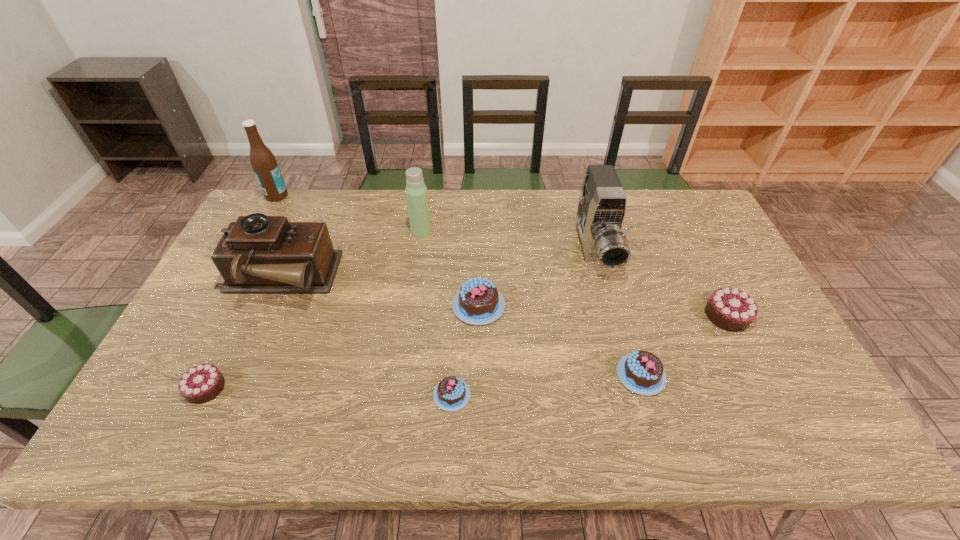
The width and height of the screenshot is (960, 540). I want to click on free region located 0.150m on the left of the rightmost chocolate cake, so click(652, 315).

Locate an element on the screen. blank space located on the right of the rightmost pink chocolate cake is located at coordinates (693, 375).

Where is `free location located on the right of the nearer chocolate chocolate cake`? Image resolution: width=960 pixels, height=540 pixels. free location located on the right of the nearer chocolate chocolate cake is located at coordinates (250, 388).

The image size is (960, 540). What are the coordinates of `free space located 0.180m on the back of the shortest chocolate cake` in the screenshot? It's located at (456, 321).

At what (x,y) coordinates should I click in order to perform the action: click on beer bottle present at the far edge. Please return your answer as a coordinate pair (x, y). Image resolution: width=960 pixels, height=540 pixels. Looking at the image, I should click on (264, 164).

In order to click on camcorder at the far edge in this screenshot , I will do 601,211.

Locate an element on the screen. This screenshot has height=540, width=960. thermos bottle that is positioned at the far edge is located at coordinates (416, 191).

Where is `object located in the near edge section of the desktop`? The image size is (960, 540). object located in the near edge section of the desktop is located at coordinates 451,394.

Find the location of a particular element. beer bottle that is at the left edge is located at coordinates (264, 164).

At what (x,y) coordinates should I click in order to perform the action: click on phonograph_record that is at the left edge. Please return your answer as a coordinate pair (x, y). The width and height of the screenshot is (960, 540). Looking at the image, I should click on (259, 254).